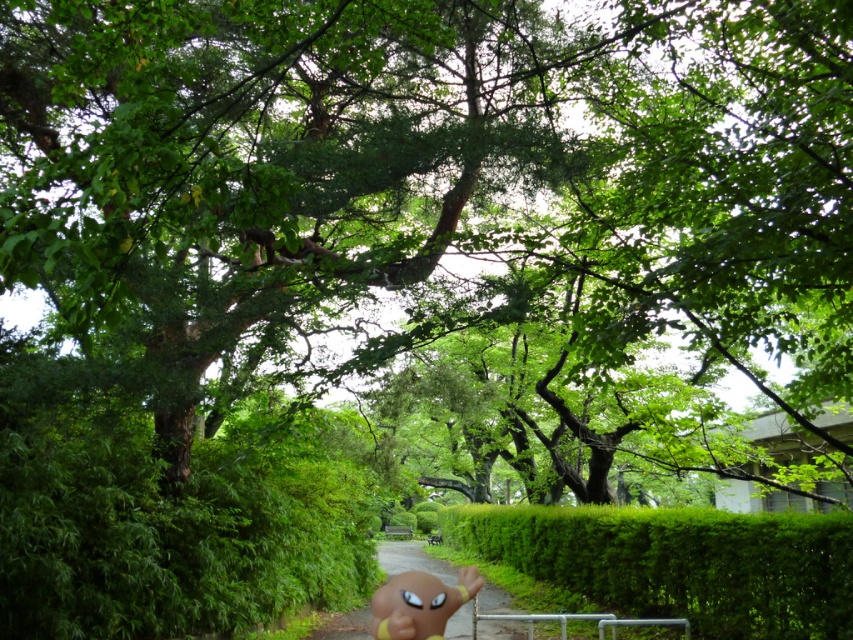
You are a hiker who wants to take a photo of the green leafy hedge at center and the green grassy path at center. Which object is shorter in height?

The green leafy hedge at center is not as tall as the green grassy path at center, so the green leafy hedge at center is shorter in height.

You are a hiker who wants to walk on the green grassy path at center. However, there is a yellow rubber doll at lower center in your way. Can you step around it to reach the path?

The green grassy path at center is positioned under the yellow rubber doll at lower center, meaning the doll is directly above the path. To step around it, you would need to move to either side of the yellow rubber doll at lower center to access the path.